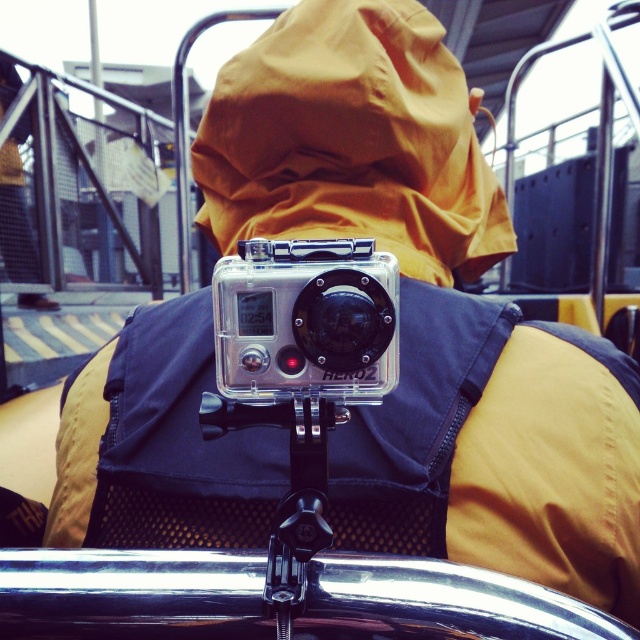
Which is more to the left, clear plastic camera at center or black plastic tripod at center?

clear plastic camera at center

How distant is clear plastic camera at center from black plastic tripod at center?

A distance of 2.06 inches exists between clear plastic camera at center and black plastic tripod at center.

Is point (342, 266) positioned behind point (316, 528)?

Yes, point (342, 266) is farther from viewer.

Image resolution: width=640 pixels, height=640 pixels. Identify the location of clear plastic camera at center. (305, 321).